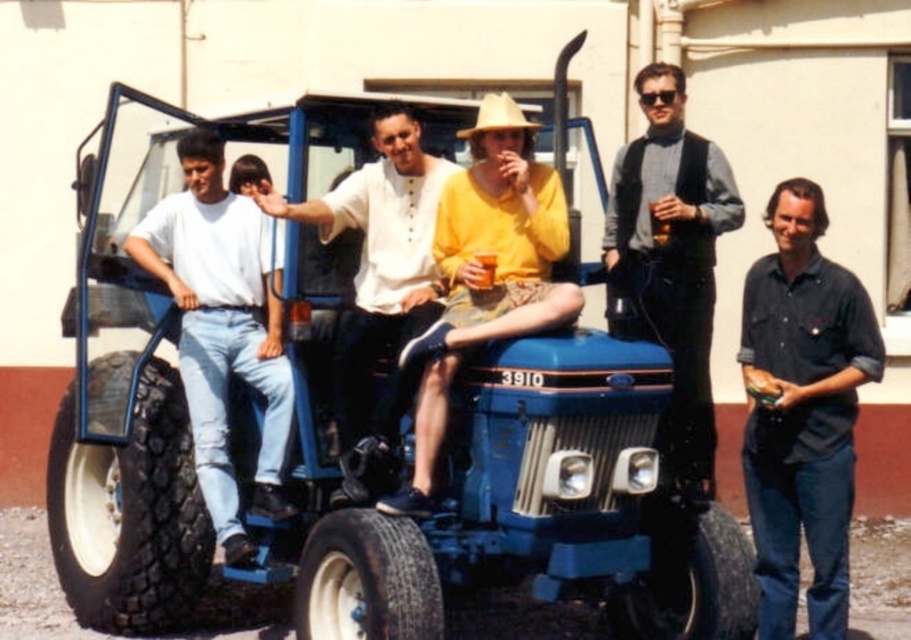
You are a photographer trying to capture a group photo of the blue rubber tractor at center and the white cotton shirt at center. Since you want to ensure both are fully visible in the frame, which object should you position closer to the camera to avoid cropping?

The blue rubber tractor at center is wider than the white cotton shirt at center, so positioning the blue rubber tractor at center closer to the camera will help ensure both fit within the frame without cropping.

You are standing at the point marked by the coordinates (377, 285) in the image. Looking around, you see a blue tractor and several people. Which object is closest to your current position?

The white cotton shirt at center is closest to the point marked by the coordinates (377, 285).